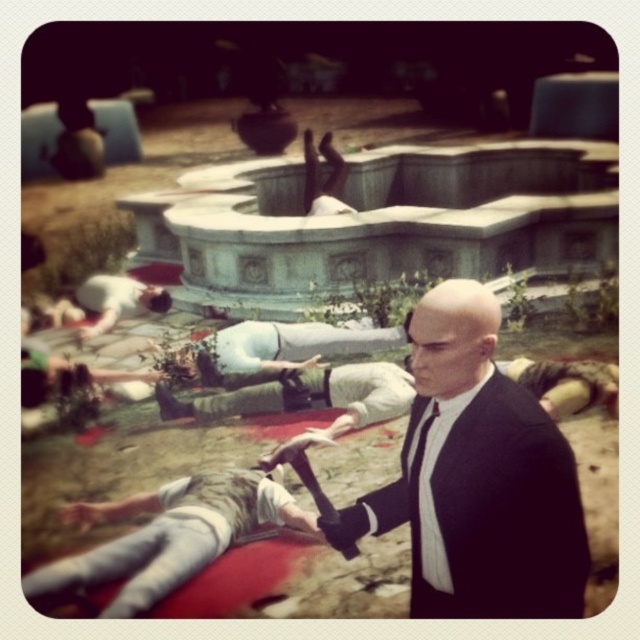
Question: Which point is closer to the camera taking this photo?

Choices:
 (A) (156, 376)
 (B) (97, 330)

Answer: (A)

Question: Which object appears farthest from the camera in this image?

Choices:
 (A) matte black hand at lower center
 (B) smooth skin hand at lower left
 (C) matte black hand at center

Answer: (B)

Question: In this image, where is camouflage fabric body at center located relative to matte black hand at lower left?

Choices:
 (A) right
 (B) left

Answer: (A)

Question: Does black matte suit at center come in front of matte black hand at center?

Choices:
 (A) yes
 (B) no

Answer: (A)

Question: Is the position of black matte suit at center less distant than that of camouflage fabric body at center?

Choices:
 (A) yes
 (B) no

Answer: (A)

Question: Considering the real-world distances, which object is closest to the matte black hand at lower left?

Choices:
 (A) smooth skin hand at center
 (B) matte black hand at lower center

Answer: (B)